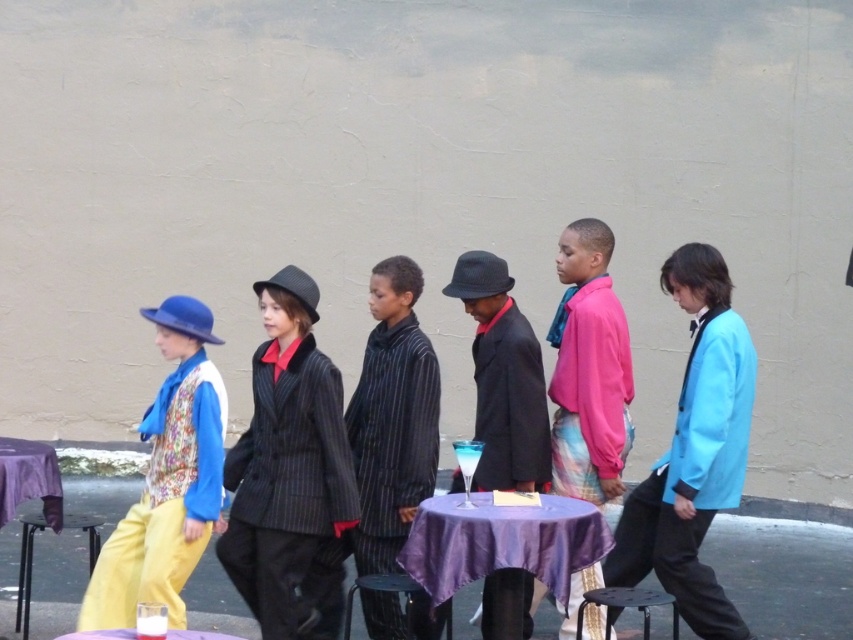
Question: Among these points, which one is farthest from the camera?

Choices:
 (A) (165, 632)
 (B) (480, 531)
 (C) (350, 595)
 (D) (635, 568)

Answer: (D)

Question: Is pink fabric shirt at center below matte black suit at center?

Choices:
 (A) no
 (B) yes

Answer: (A)

Question: Which point appears farthest from the camera in this image?

Choices:
 (A) (119, 632)
 (B) (582, 365)
 (C) (503, 296)

Answer: (B)

Question: Is purple satin table at center wider than metallic black stool at lower center?

Choices:
 (A) no
 (B) yes

Answer: (B)

Question: Considering the real-world distances, which object is farthest from the metallic stool at lower left?

Choices:
 (A) striped fabric suit at center
 (B) purple satin table at center
 (C) light blue satin blazer at center
 (D) floral fabric vest at left

Answer: (C)

Question: Can you confirm if striped fabric suit at center is thinner than metallic stool at lower left?

Choices:
 (A) yes
 (B) no

Answer: (A)